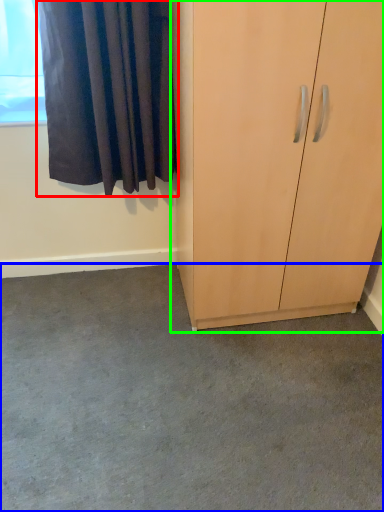
Question: Which is farther away from curtain (highlighted by a red box)? concrete (highlighted by a blue box) or cupboard (highlighted by a green box)?

Choices:
 (A) concrete
 (B) cupboard

Answer: (A)